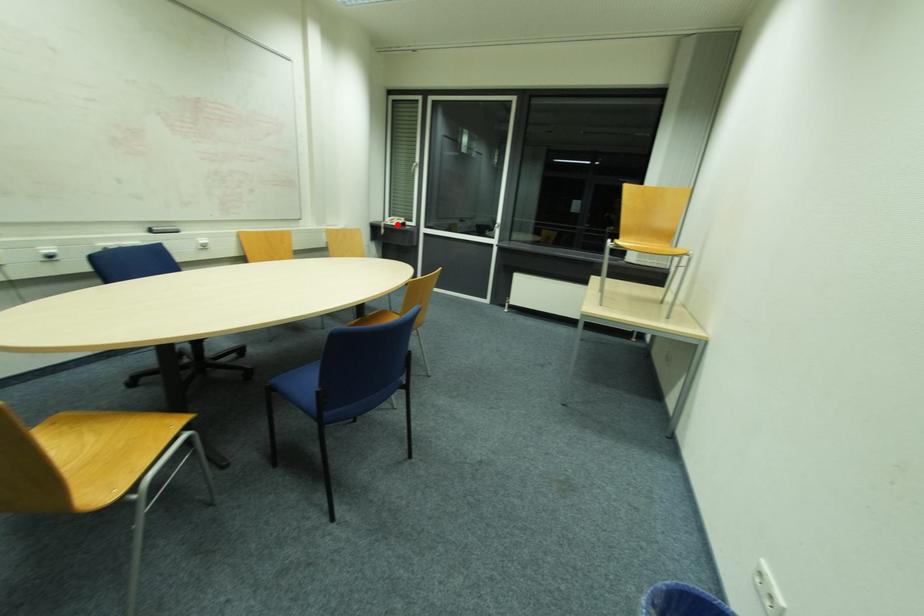
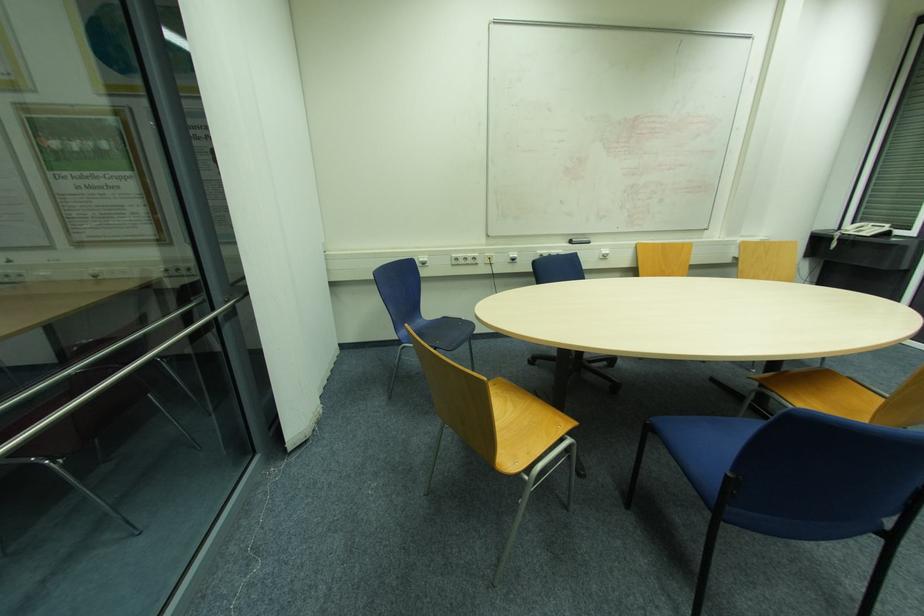
In the second image, find the point that corresponds to the highlighted location in the first image.

(869, 233)